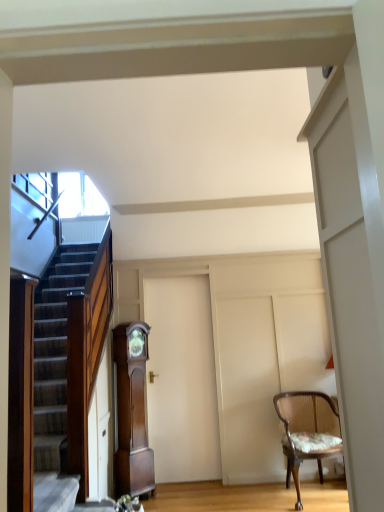
Question: From a real-world perspective, is white matte door at center below mahogany wood grandfather clock at center?

Choices:
 (A) no
 (B) yes

Answer: (A)

Question: From the image's perspective, is white matte door at center over mahogany wood grandfather clock at center?

Choices:
 (A) no
 (B) yes

Answer: (B)

Question: From a real-world perspective, is white matte door at center located higher than mahogany wood grandfather clock at center?

Choices:
 (A) yes
 (B) no

Answer: (A)

Question: Is white matte door at center closer to camera compared to mahogany wood grandfather clock at center?

Choices:
 (A) no
 (B) yes

Answer: (A)

Question: Does white matte door at center have a larger size compared to mahogany wood grandfather clock at center?

Choices:
 (A) no
 (B) yes

Answer: (B)

Question: Is mahogany wood grandfather clock at center at the back of white matte door at center?

Choices:
 (A) yes
 (B) no

Answer: (B)

Question: From the image's perspective, does mahogany wood grandfather clock at center appear higher than white matte door at center?

Choices:
 (A) yes
 (B) no

Answer: (B)

Question: Does mahogany wood grandfather clock at center lie in front of white matte door at center?

Choices:
 (A) no
 (B) yes

Answer: (B)

Question: Is the position of mahogany wood grandfather clock at center more distant than that of white matte door at center?

Choices:
 (A) no
 (B) yes

Answer: (A)

Question: Can you confirm if mahogany wood grandfather clock at center is bigger than white matte door at center?

Choices:
 (A) no
 (B) yes

Answer: (A)

Question: Considering the relative positions of mahogany wood grandfather clock at center and white matte door at center in the image provided, is mahogany wood grandfather clock at center to the right of white matte door at center from the viewer's perspective?

Choices:
 (A) no
 (B) yes

Answer: (A)

Question: Is mahogany wood grandfather clock at center facing towards white matte door at center?

Choices:
 (A) no
 (B) yes

Answer: (A)

Question: Can you confirm if wooden textured chair at right is positioned to the left of white matte door at center?

Choices:
 (A) yes
 (B) no

Answer: (B)